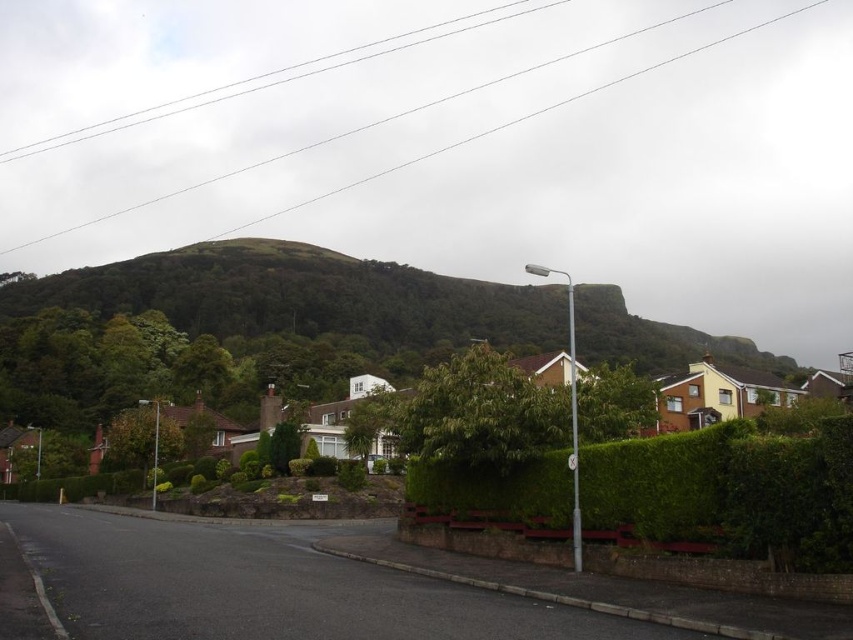
You are standing on the suburban street and want to take a photo of both the green leafy hillside at upper center and the green leafy hedge at center. Which object should you focus on first to ensure both are in clear view?

You should focus on the green leafy hedge at center first because it is closer to you than the green leafy hillside at upper center, ensuring both are in clear view.

You are standing on the suburban street scene and want to walk from the point at coordinates (755,429) to the point at (254,296). Based on the scene description, which direction should you face to move towards the second point?

Since point (254,296) is behind point (755,429), you should face away from the direction of the hillside to move towards the second point.